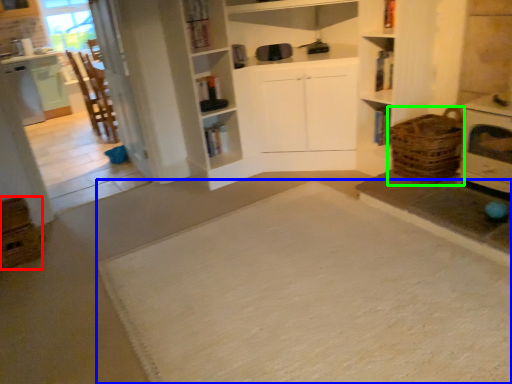
Question: Which object is the farthest from crate (highlighted by a red box)? Choose among these: doormat (highlighted by a blue box) or basket (highlighted by a green box).

Choices:
 (A) doormat
 (B) basket

Answer: (B)